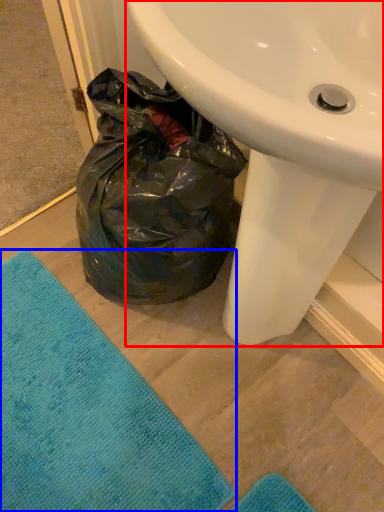
Question: Which object appears closest to the camera in this image, sink (highlighted by a red box) or beach towel (highlighted by a blue box)?

Choices:
 (A) sink
 (B) beach towel

Answer: (A)